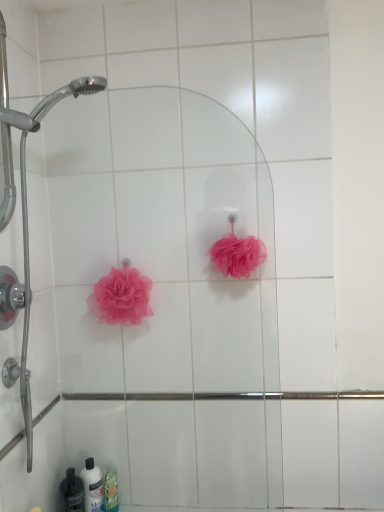
Question: From the image's perspective, is pink mesh sponge at center, the 2th rose viewed from the left, located above white glossy bottle at lower left, which is the 2th toiletry in left-to-right order?

Choices:
 (A) no
 (B) yes

Answer: (B)

Question: Is the position of pink mesh sponge at center, which is counted as the first rose, starting from the right, less distant than that of white glossy bottle at lower left, which is the 2th toiletry in left-to-right order?

Choices:
 (A) yes
 (B) no

Answer: (A)

Question: Is pink mesh sponge at center, which is counted as the first rose, starting from the right, at the right side of white glossy bottle at lower left, which is the 2th toiletry in left-to-right order?

Choices:
 (A) no
 (B) yes

Answer: (B)

Question: Can you confirm if pink mesh sponge at center, which is counted as the first rose, starting from the right, is positioned to the left of white glossy bottle at lower left, which is the 2th toiletry in left-to-right order?

Choices:
 (A) no
 (B) yes

Answer: (A)

Question: Is pink mesh sponge at center, the 2th rose viewed from the left, oriented towards white glossy bottle at lower left, which is the 2th toiletry in left-to-right order?

Choices:
 (A) yes
 (B) no

Answer: (B)

Question: Is pink mesh sponge at center, which is counted as the first rose, starting from the right, wider or thinner than white glossy bottle at lower left, which is the second toiletry in right-to-left order?

Choices:
 (A) thin
 (B) wide

Answer: (B)

Question: Looking at the image, does pink mesh sponge at center, the 2th rose viewed from the left, seem bigger or smaller compared to white glossy bottle at lower left, which is the 2th toiletry in left-to-right order?

Choices:
 (A) small
 (B) big

Answer: (B)

Question: Is pink mesh sponge at center, the 2th rose viewed from the left, in front of or behind white glossy bottle at lower left, which is the 2th toiletry in left-to-right order, in the image?

Choices:
 (A) behind
 (B) front

Answer: (B)

Question: Considering the positions of pink mesh sponge at center, which is counted as the first rose, starting from the right, and white glossy bottle at lower left, which is the 2th toiletry in left-to-right order, in the image, is pink mesh sponge at center, which is counted as the first rose, starting from the right, taller or shorter than white glossy bottle at lower left, which is the 2th toiletry in left-to-right order,?

Choices:
 (A) tall
 (B) short

Answer: (A)

Question: Based on their sizes in the image, would you say pink mesh sponge at upper center is bigger or smaller than white glossy bottle at lower left, which is the 2th toiletry in left-to-right order?

Choices:
 (A) big
 (B) small

Answer: (A)

Question: Is pink mesh sponge at upper center wider or thinner than white glossy bottle at lower left, which is the second toiletry in right-to-left order?

Choices:
 (A) wide
 (B) thin

Answer: (B)

Question: Is pink mesh sponge at upper center spatially inside white glossy bottle at lower left, which is the 2th toiletry in left-to-right order, or outside of it?

Choices:
 (A) inside
 (B) outside

Answer: (B)

Question: Considering their positions, is pink mesh sponge at upper center located in front of or behind white glossy bottle at lower left, which is the 2th toiletry in left-to-right order?

Choices:
 (A) behind
 (B) front

Answer: (B)

Question: Looking at their shapes, would you say translucent plastic bottle at lower left, the 1th toiletry in the left-to-right sequence, is wider or thinner than pink mesh sponge at lower left, which appears as the 2th rose when viewed from the right?

Choices:
 (A) thin
 (B) wide

Answer: (A)

Question: From their relative heights in the image, would you say translucent plastic bottle at lower left, the 1th toiletry in the left-to-right sequence, is taller or shorter than pink mesh sponge at lower left, which appears as the 2th rose when viewed from the right?

Choices:
 (A) short
 (B) tall

Answer: (A)